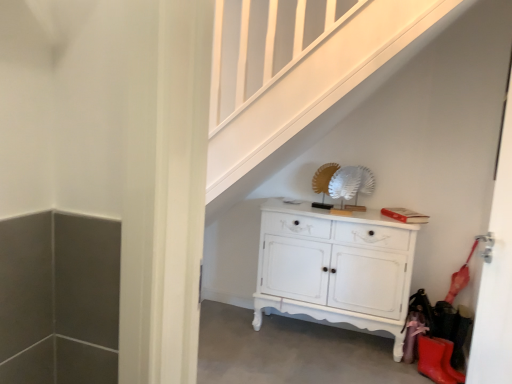
Question: From a real-world perspective, does white painted wood cabinet at center sit lower than white glossy door at right?

Choices:
 (A) no
 (B) yes

Answer: (B)

Question: Is white painted wood cabinet at center positioned with its back to white glossy door at right?

Choices:
 (A) no
 (B) yes

Answer: (A)

Question: From the image's perspective, is white painted wood cabinet at center beneath white glossy door at right?

Choices:
 (A) no
 (B) yes

Answer: (B)

Question: Is white painted wood cabinet at center not close to white glossy door at right?

Choices:
 (A) yes
 (B) no

Answer: (A)

Question: Is white painted wood cabinet at center outside white glossy door at right?

Choices:
 (A) yes
 (B) no

Answer: (A)

Question: In the image, is white painted wood cabinet at center positioned in front of or behind rubber matte boot at lower right?

Choices:
 (A) front
 (B) behind

Answer: (B)

Question: From the image's perspective, is white painted wood cabinet at center above or below rubber matte boot at lower right?

Choices:
 (A) above
 (B) below

Answer: (A)

Question: Visually, is white painted wood cabinet at center positioned to the left or to the right of rubber matte boot at lower right?

Choices:
 (A) right
 (B) left

Answer: (B)

Question: From a real-world perspective, is white painted wood cabinet at center above or below rubber matte boot at lower right?

Choices:
 (A) above
 (B) below

Answer: (A)

Question: Looking at their shapes, would you say white glossy door at right is wider or thinner than white painted wood cabinet at center?

Choices:
 (A) wide
 (B) thin

Answer: (B)

Question: Would you say white glossy door at right is to the left or to the right of white painted wood cabinet at center in the picture?

Choices:
 (A) left
 (B) right

Answer: (B)

Question: From the image's perspective, is white glossy door at right positioned above or below white painted wood cabinet at center?

Choices:
 (A) below
 (B) above

Answer: (B)

Question: Is white glossy door at right bigger or smaller than white painted wood cabinet at center?

Choices:
 (A) big
 (B) small

Answer: (B)

Question: Do you think white painted wood cabinet at center is within white glossy door at right, or outside of it?

Choices:
 (A) inside
 (B) outside

Answer: (B)

Question: In the image, is white painted wood cabinet at center on the left side or the right side of white glossy door at right?

Choices:
 (A) right
 (B) left

Answer: (B)